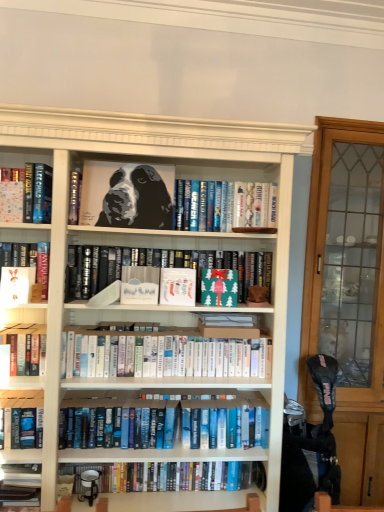
Question: Choose the correct answer: Is white paperbacks at center, which is the fourth book from top to bottom, inside matte black book at center, placed as the 3th book when sorted from top to bottom, or outside it?

Choices:
 (A) outside
 (B) inside

Answer: (A)

Question: Is point pos(213,373) closer or farther from the camera than point pos(71,266)?

Choices:
 (A) closer
 (B) farther

Answer: (A)

Question: Considering the real-world distances, which object is closest to the black glossy painting of a dog at center?

Choices:
 (A) white matte paper at left, the second paperback book positioned from the left
 (B) hardcover book at lower left, the fifth book when ordered from top to bottom
 (C) hardcover book at left, which is the second book from top to bottom
 (D) black matte portrait at upper center, which is the 7th book in bottom-to-top order
 (E) matte paper book at left, placed as the fifth paperback book when sorted from right to left

Answer: (D)

Question: Considering the real-world distances, which object is farthest from the black matte portrait at upper center, which is the 7th book in bottom-to-top order?

Choices:
 (A) green paper at center, which is the 1th paperback book from right to left
 (B) matte paper book at left, placed as the fifth paperback book when sorted from right to left
 (C) white matte paper at left, the 4th paperback book in the right-to-left sequence
 (D) black glossy painting of a dog at center
 (E) white paperbacks at center, which is the fourth book from top to bottom

Answer: (C)